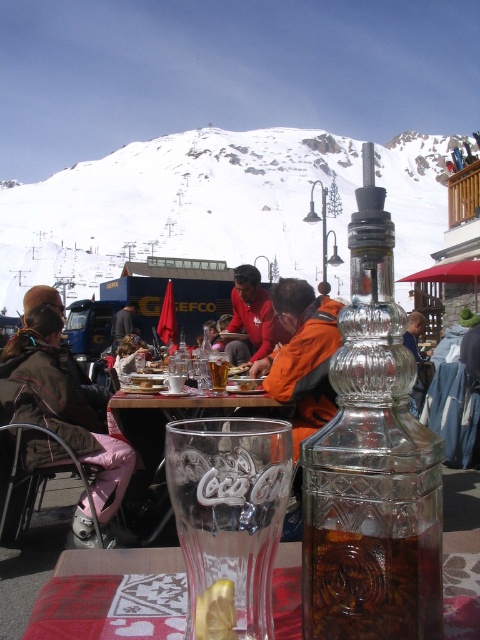
Does white snow at upper left appear over translucent glass cup at center?

Correct, white snow at upper left is located above translucent glass cup at center.

Who is more forward, (183, 196) or (217, 380)?

Point (217, 380) is more forward.

Locate an element on the screen. The height and width of the screenshot is (640, 480). white snow at upper left is located at coordinates (179, 209).

Can you confirm if brown glass bottle at center is wider than clear glass coca-cola cup at center?

No, brown glass bottle at center is not wider than clear glass coca-cola cup at center.

Describe the element at coordinates (371, 580) in the screenshot. The image size is (480, 640). I see `brown glass bottle at center` at that location.

What are the coordinates of `brown glass bottle at center` in the screenshot? It's located at (371, 580).

Is point (388, 296) more distant than point (82, 608)?

No, (388, 296) is closer to viewer.

Is transparent glass bottle at center further to camera compared to red woven cloth at lower center?

No, transparent glass bottle at center is in front of red woven cloth at lower center.

Does point (324, 628) come farther from viewer compared to point (479, 588)?

No, it is not.

Identify the location of transparent glass bottle at center. (372, 464).